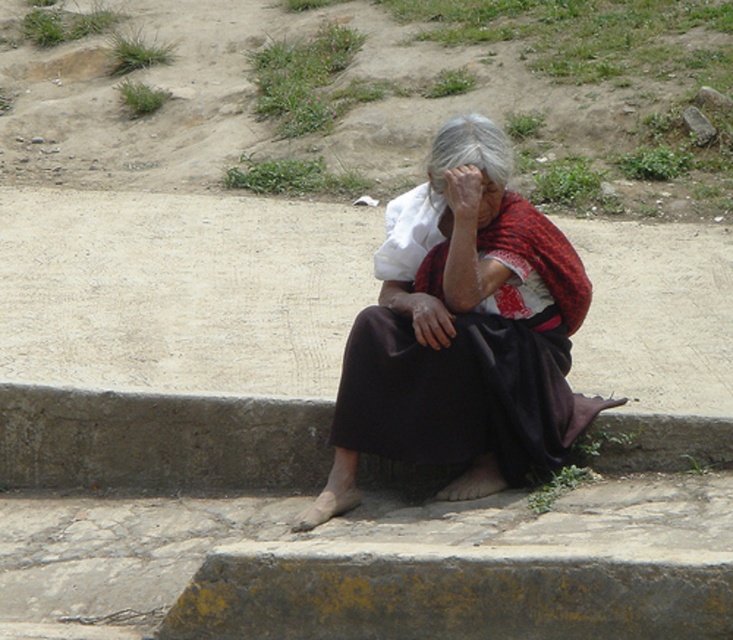
Question: Can you confirm if dirt ground at upper center is smaller than gray concrete curb at lower center?

Choices:
 (A) yes
 (B) no

Answer: (B)

Question: Is dirt ground at upper center positioned behind gray concrete curb at lower center?

Choices:
 (A) no
 (B) yes

Answer: (B)

Question: Which object is farther from the camera taking this photo?

Choices:
 (A) dirt ground at upper center
 (B) gray concrete curb at lower center
 (C) dark brown fabric skirt at center
 (D) smooth skin face at center

Answer: (A)

Question: Among these points, which one is nearest to the camera?

Choices:
 (A) (4, 481)
 (B) (465, 218)

Answer: (B)

Question: Which object is farther from the camera taking this photo?

Choices:
 (A) gray concrete curb at lower center
 (B) dark brown fabric skirt at center

Answer: (A)

Question: Can you confirm if dirt ground at upper center is smaller than dark brown fabric skirt at center?

Choices:
 (A) yes
 (B) no

Answer: (B)